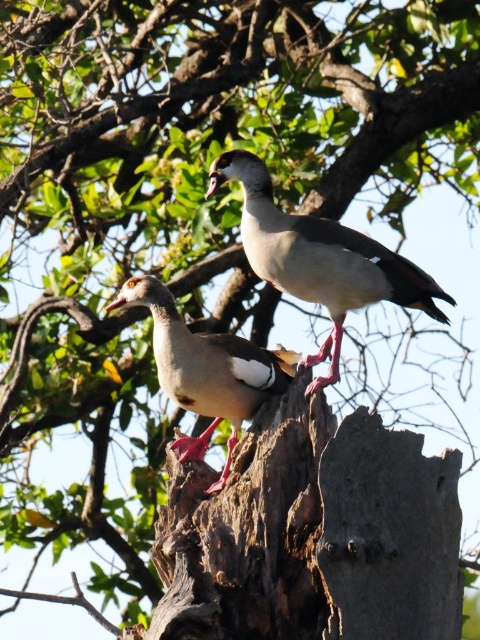
Question: Considering the real-world distances, which object is closest to the white feathered duck at center?

Choices:
 (A) brown rough tree trunk at center
 (B) brown feathered duck at center

Answer: (B)

Question: Is white feathered duck at center bigger than brown feathered duck at center?

Choices:
 (A) no
 (B) yes

Answer: (B)

Question: Which object is farther from the camera taking this photo?

Choices:
 (A) brown rough tree trunk at center
 (B) white feathered duck at center

Answer: (B)

Question: Among these objects, which one is nearest to the camera?

Choices:
 (A) brown feathered duck at center
 (B) brown rough tree trunk at center
 (C) white feathered duck at center

Answer: (B)

Question: Is the position of white feathered duck at center less distant than that of brown feathered duck at center?

Choices:
 (A) no
 (B) yes

Answer: (B)

Question: Can you confirm if brown rough tree trunk at center is thinner than brown feathered duck at center?

Choices:
 (A) no
 (B) yes

Answer: (A)